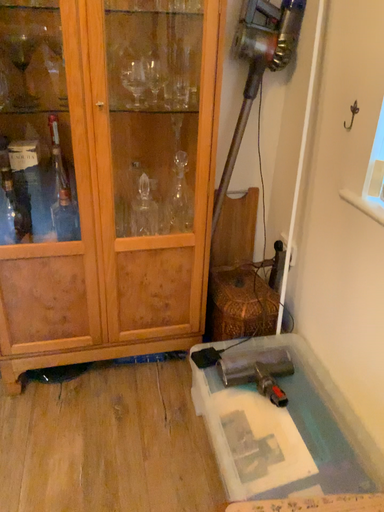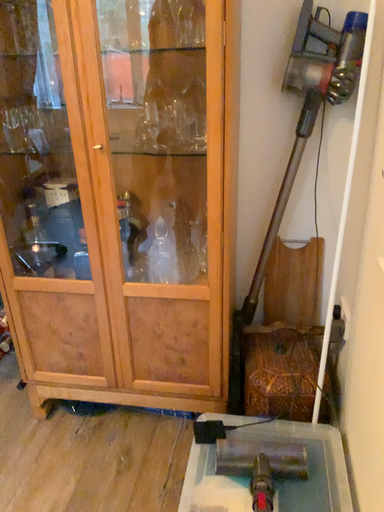
Question: How did the camera likely rotate when shooting the video?

Choices:
 (A) rotated left
 (B) rotated right

Answer: (A)